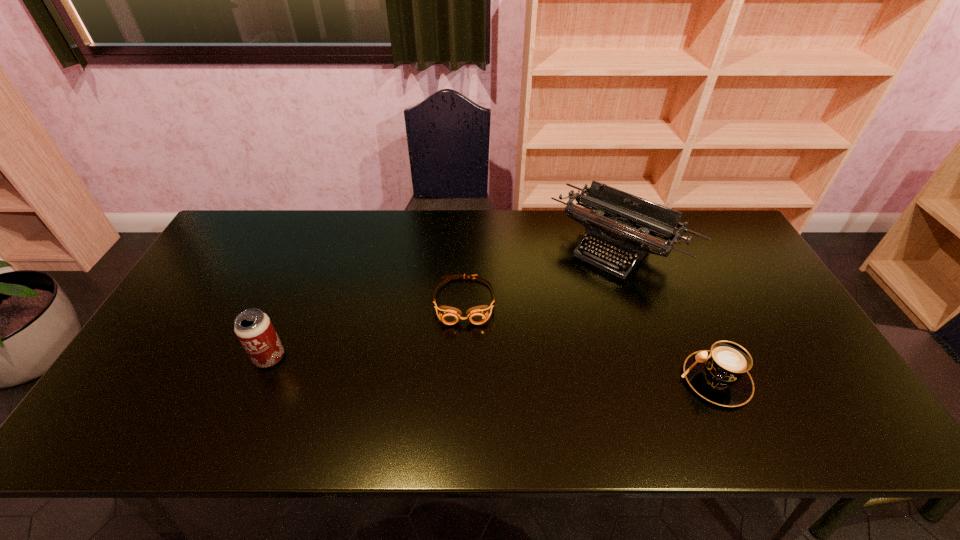
Where is `free space on the desktop that is between the leftmost object and the third tallest object and is positioned on the typing side of the typewriter`? The height and width of the screenshot is (540, 960). free space on the desktop that is between the leftmost object and the third tallest object and is positioned on the typing side of the typewriter is located at coordinates (505, 369).

You are a GUI agent. You are given a task and a screenshot of the screen. Output one action in this format:
    pyautogui.click(x=<x>, y=<y>)
    Task: Click on the vacant space on the desktop that is between the beer can and the second shortest object and is positioned with the lenses facing forward on the second object from left to right
    The height and width of the screenshot is (540, 960).
    Given the screenshot: What is the action you would take?
    pyautogui.click(x=464, y=367)